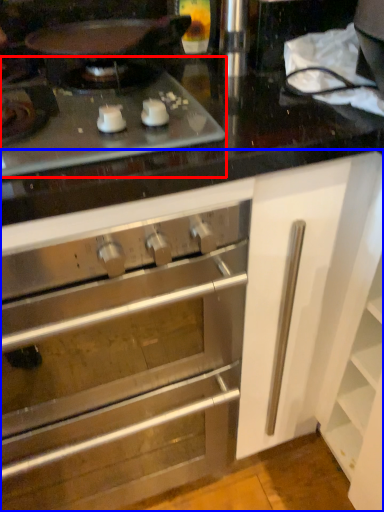
Question: Which object is further to the camera taking this photo, gas stove (highlighted by a red box) or cabinetry (highlighted by a blue box)?

Choices:
 (A) gas stove
 (B) cabinetry

Answer: (A)